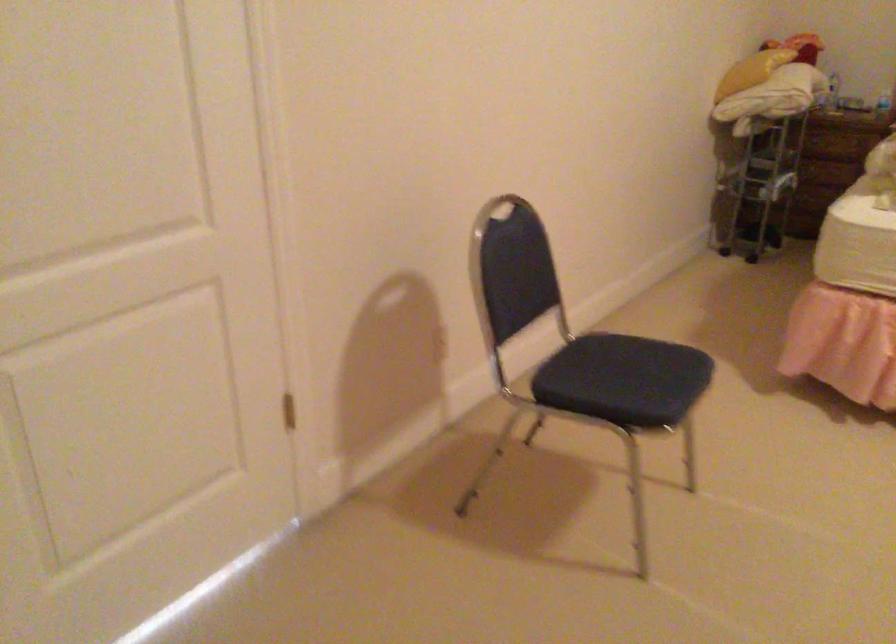
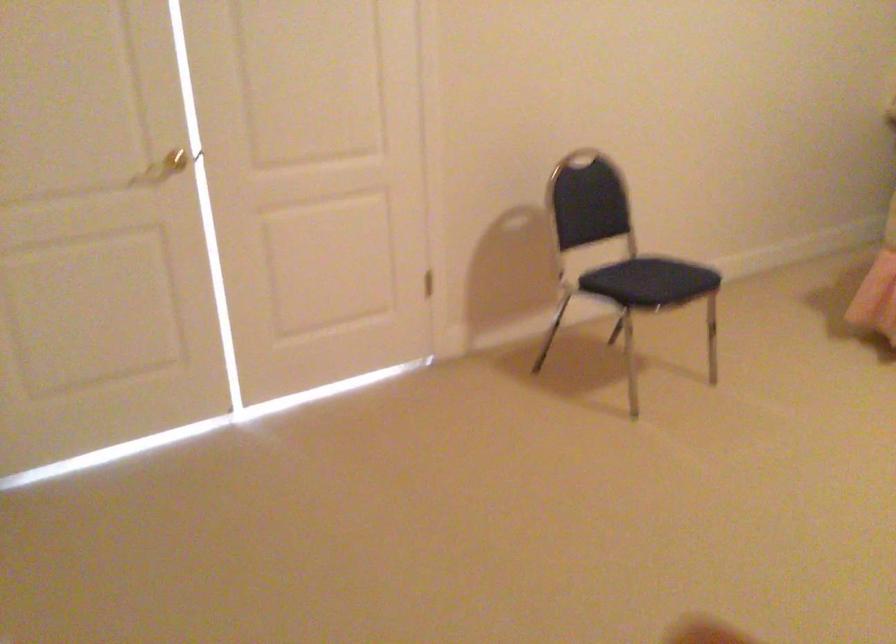
Find the pixel in the second image that matches point 640,373 in the first image.

(657, 276)